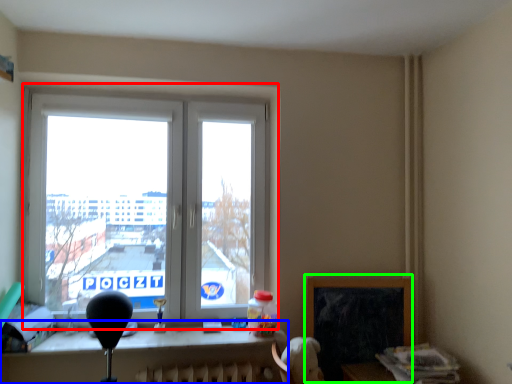
Question: Estimate the real-world distances between objects in this image. Which object is farther from window (highlighted by a red box), table (highlighted by a blue box) or window screen (highlighted by a green box)?

Choices:
 (A) table
 (B) window screen

Answer: (B)